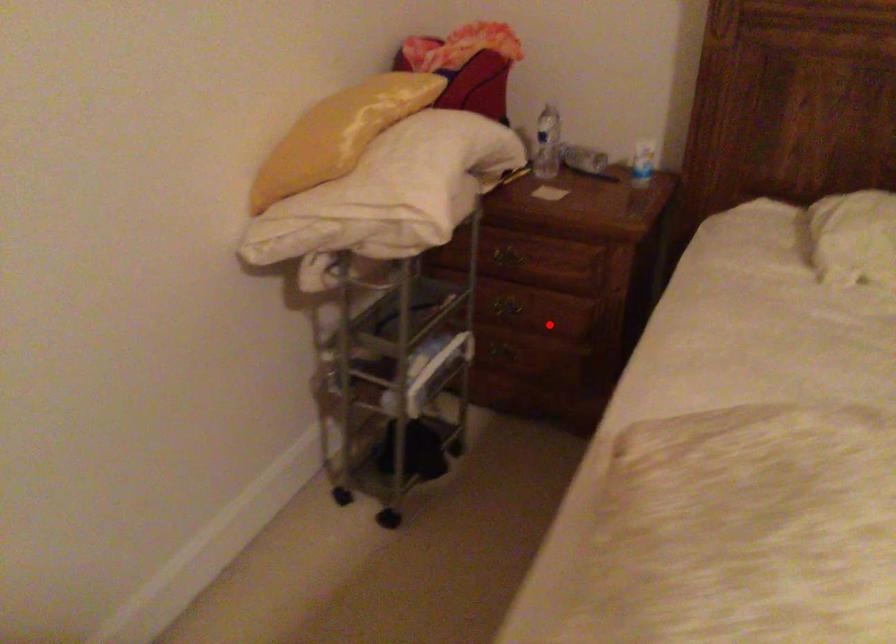
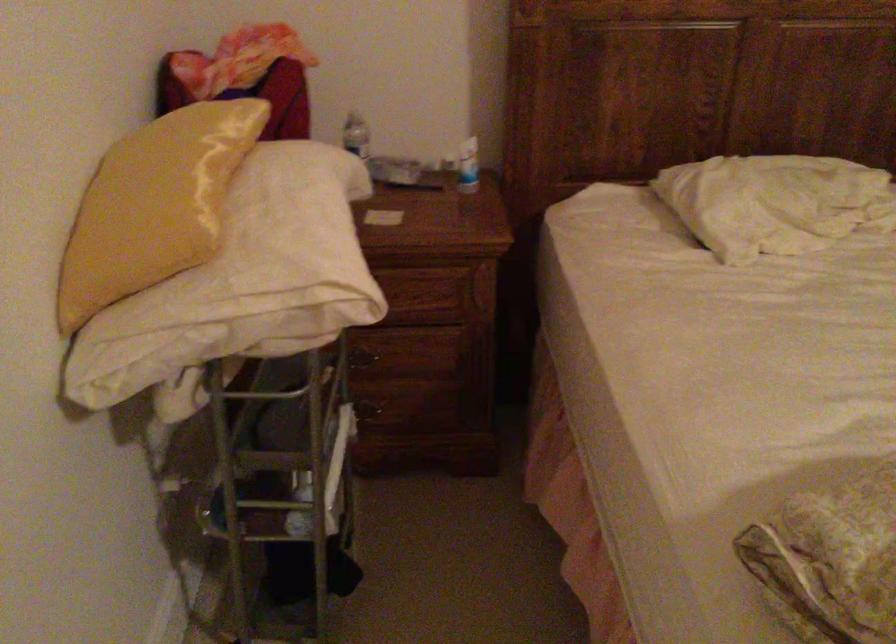
Question: A red point is marked in image1. In image2, is the corresponding 3D point closer to the camera or farther? Reply with the corresponding letter.

Choices:
 (A) The corresponding 3D point is closer.
 (B) The corresponding 3D point is farther.

Answer: (A)